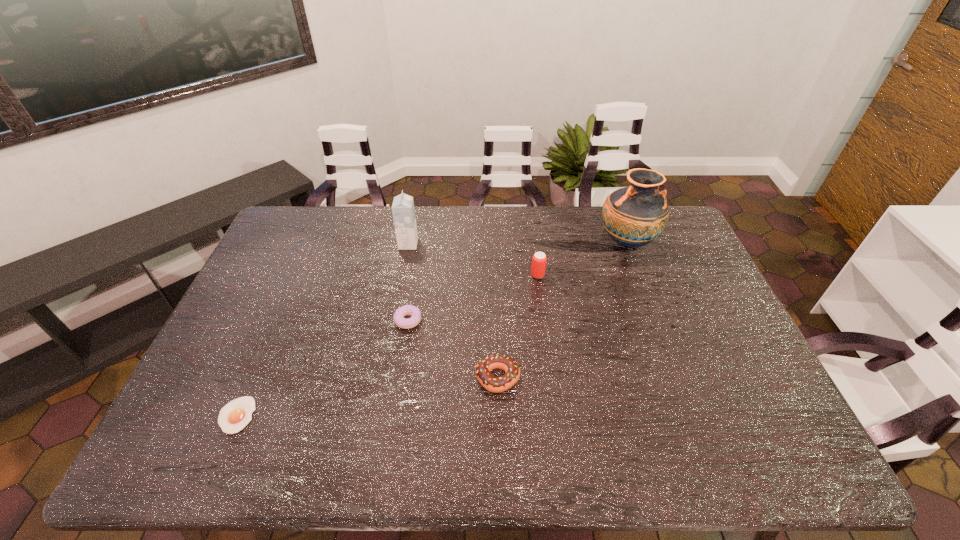
The image size is (960, 540). Identify the location of free space between the second object from right to left and the egg yolk. (387, 345).

The height and width of the screenshot is (540, 960). What are the coordinates of `free area in between the fifth farthest object and the second shortest object` in the screenshot? It's located at (453, 349).

Locate an element on the screen. free space between the shortest object and the tallest object is located at coordinates (432, 329).

Where is `empty space that is in between the rightmost object and the farther doughnut`? This screenshot has width=960, height=540. empty space that is in between the rightmost object and the farther doughnut is located at coordinates (517, 281).

Where is `free spot between the farther doughnut and the third farthest object`? Image resolution: width=960 pixels, height=540 pixels. free spot between the farther doughnut and the third farthest object is located at coordinates (472, 298).

The height and width of the screenshot is (540, 960). I want to click on vacant area between the rightmost object and the shortest object, so click(x=432, y=329).

The width and height of the screenshot is (960, 540). I want to click on unoccupied area between the leftmost object and the shorter doughnut, so click(323, 368).

I want to click on vacant space that is in between the leftmost object and the second tallest object, so click(323, 329).

Find the location of a particular element. The height and width of the screenshot is (540, 960). free space between the third shortest object and the pottery is located at coordinates (563, 310).

At what (x,y) coordinates should I click in order to perform the action: click on free space that is in between the second object from right to left and the fourth farthest object. Please return your answer as a coordinate pair (x, y). Looking at the image, I should click on (472, 298).